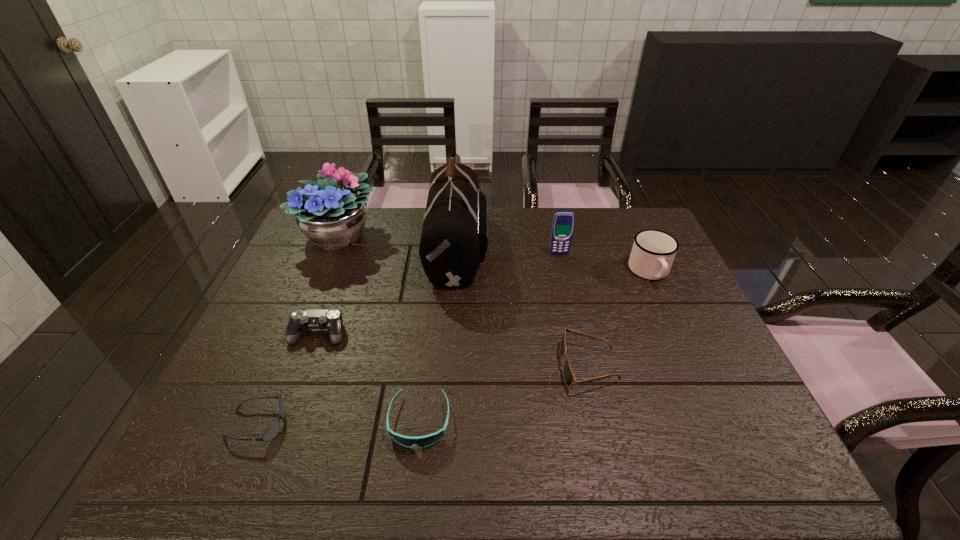
Locate an element on the screen. Image resolution: width=960 pixels, height=540 pixels. the tallest object is located at coordinates (454, 239).

This screenshot has height=540, width=960. What are the coordinates of `the second tallest object` in the screenshot? It's located at (330, 212).

The image size is (960, 540). I want to click on cellular telephone, so click(x=563, y=222).

Where is `mug`? mug is located at coordinates [x=653, y=251].

Where is `the fourth tallest object`? the fourth tallest object is located at coordinates (653, 251).

The width and height of the screenshot is (960, 540). What are the coordinates of `control` in the screenshot? It's located at (331, 319).

This screenshot has width=960, height=540. I want to click on the rightmost sunglasses, so click(569, 378).

Locate an element on the screen. the second sunglasses from right to left is located at coordinates (421, 441).

This screenshot has width=960, height=540. I want to click on the shortest object, so click(x=272, y=432).

Where is `the shortest sunglasses`? the shortest sunglasses is located at coordinates click(272, 432).